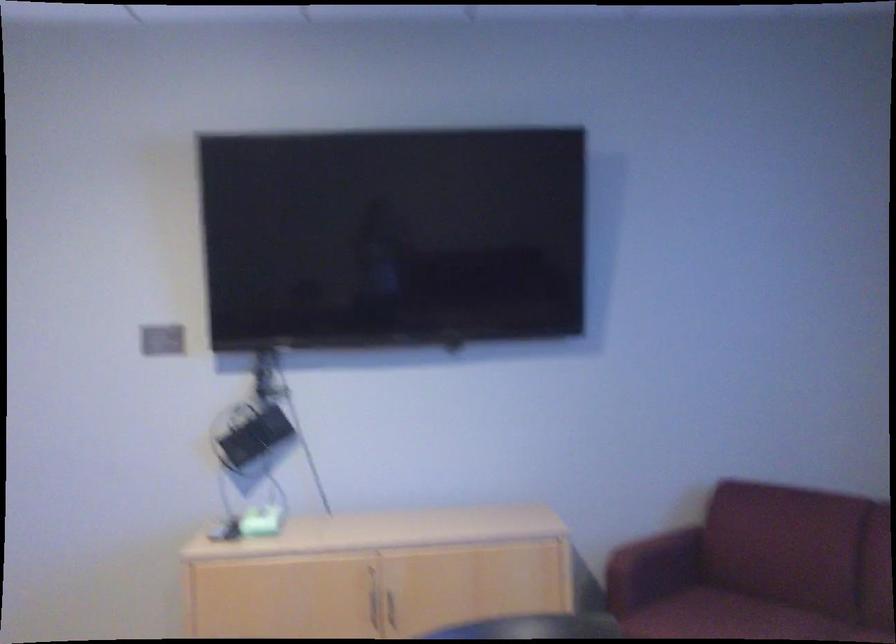
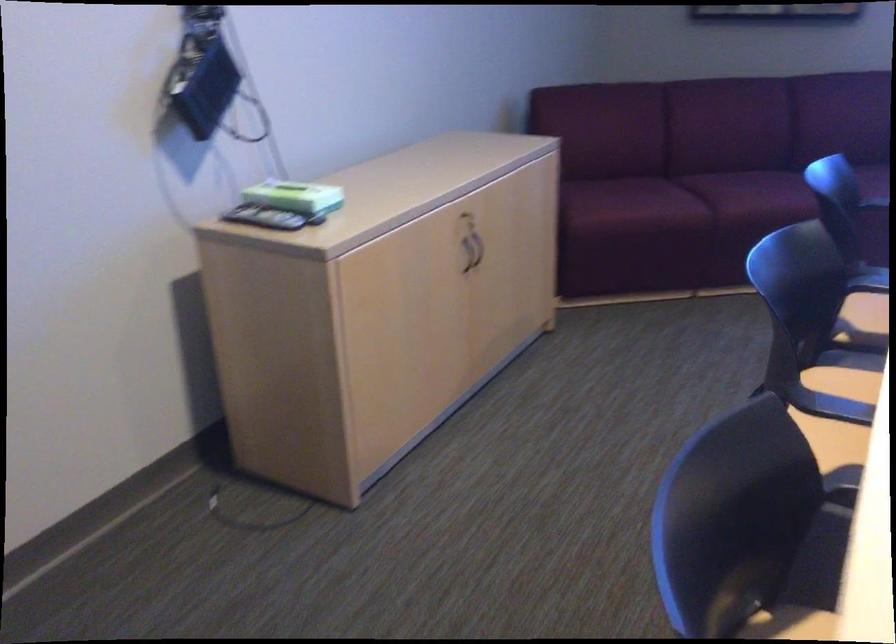
Locate, in the second image, the point that corresponds to [378,531] in the first image.

(428, 175)